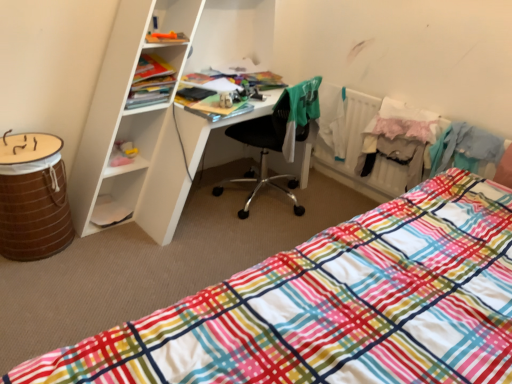
Question: Is green fabric shirt at center, which is counted as the 2th clothing, starting from the right, to the right of matte plastic cabinet at upper left from the viewer's perspective?

Choices:
 (A) yes
 (B) no

Answer: (A)

Question: From the image's perspective, is green fabric shirt at center, which is the first clothing from left to right, located above matte plastic cabinet at upper left?

Choices:
 (A) no
 (B) yes

Answer: (A)

Question: Can we say green fabric shirt at center, which is the first clothing from left to right, lies outside matte plastic cabinet at upper left?

Choices:
 (A) yes
 (B) no

Answer: (A)

Question: Is green fabric shirt at center, which is the first clothing from left to right, thinner than matte plastic cabinet at upper left?

Choices:
 (A) no
 (B) yes

Answer: (B)

Question: From a real-world perspective, does green fabric shirt at center, which is counted as the 2th clothing, starting from the right, stand above matte plastic cabinet at upper left?

Choices:
 (A) yes
 (B) no

Answer: (B)

Question: Is green fabric shirt at center, which is the first clothing from left to right, not near matte plastic cabinet at upper left?

Choices:
 (A) no
 (B) yes

Answer: (A)

Question: Is brown woven barrel at lower left smaller than green fabric shirt at center, which is counted as the 2th clothing, starting from the right?

Choices:
 (A) yes
 (B) no

Answer: (B)

Question: From a real-world perspective, is brown woven barrel at lower left located beneath green fabric shirt at center, which is counted as the 2th clothing, starting from the right?

Choices:
 (A) no
 (B) yes

Answer: (B)

Question: Is brown woven barrel at lower left facing towards green fabric shirt at center, which is the first clothing from left to right?

Choices:
 (A) no
 (B) yes

Answer: (A)

Question: From the image's perspective, does brown woven barrel at lower left appear higher than green fabric shirt at center, which is counted as the 2th clothing, starting from the right?

Choices:
 (A) no
 (B) yes

Answer: (A)

Question: Would you say brown woven barrel at lower left contains green fabric shirt at center, which is counted as the 2th clothing, starting from the right?

Choices:
 (A) yes
 (B) no

Answer: (B)

Question: From a real-world perspective, is brown woven barrel at lower left physically above green fabric shirt at center, which is the first clothing from left to right?

Choices:
 (A) no
 (B) yes

Answer: (A)

Question: Is plaid fabric bed at lower right not close to green fabric shirt at center, which is counted as the 2th clothing, starting from the right?

Choices:
 (A) yes
 (B) no

Answer: (A)